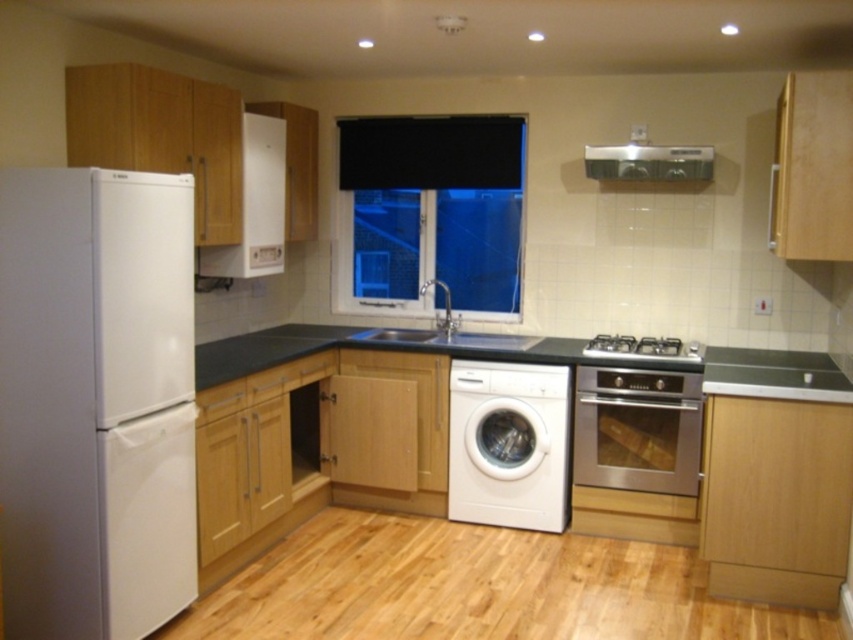
Question: Is white matte refrigerator at left above white matte washing machine at center?

Choices:
 (A) yes
 (B) no

Answer: (A)

Question: Which point is closer to the camera?

Choices:
 (A) black matte window at center
 (B) white matte washing machine at center
 (C) black granite countertop at center
 (D) satin silver metallic exhaust hood at upper center

Answer: (C)

Question: Can you confirm if black matte window at center is positioned above black granite countertop at center?

Choices:
 (A) no
 (B) yes

Answer: (B)

Question: Which point is closer to the camera?

Choices:
 (A) satin silver sink at center
 (B) black matte window at center
 (C) stainless steel gas stove at center right

Answer: (C)

Question: Which object appears closest to the camera in this image?

Choices:
 (A) black granite countertop at center
 (B) satin silver sink at center

Answer: (A)

Question: Does black granite countertop at center appear on the right side of satin silver sink at center?

Choices:
 (A) no
 (B) yes

Answer: (B)